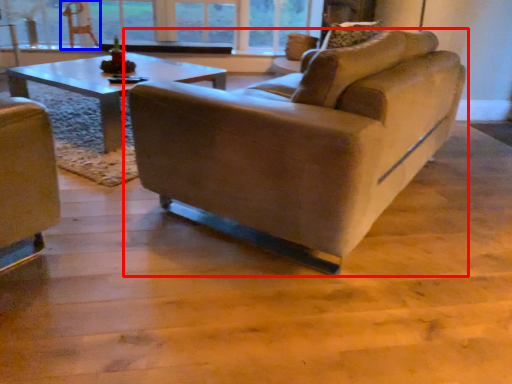
Question: Among these objects, which one is nearest to the camera, studio couch (highlighted by a red box) or swivel chair (highlighted by a blue box)?

Choices:
 (A) studio couch
 (B) swivel chair

Answer: (A)